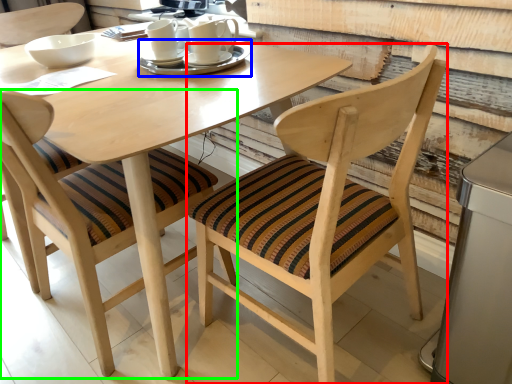
Question: Estimate the real-world distances between objects in this image. Which object is farther from chair (highlighted by a red box), tableware (highlighted by a blue box) or chair (highlighted by a green box)?

Choices:
 (A) tableware
 (B) chair

Answer: (A)